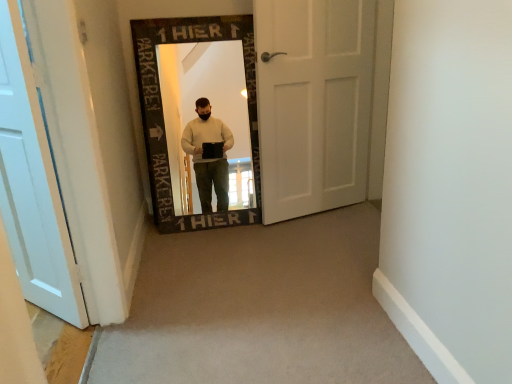
What do you see at coordinates (313, 103) in the screenshot? I see `white matte door at center, the 1th door in the back-to-front sequence` at bounding box center [313, 103].

The height and width of the screenshot is (384, 512). Find the location of `white matte door at center, positioned as the second door in left-to-right order`. white matte door at center, positioned as the second door in left-to-right order is located at coordinates (313, 103).

In order to face white matte door at center, positioned as the second door in left-to-right order, should I rotate leftwards or rightwards?

To face it directly, rotate right by 7.831 degrees.

Describe the element at coordinates (32, 185) in the screenshot. I see `white painted wood door at left, which is the second door from right to left` at that location.

This screenshot has width=512, height=384. Find the location of `white painted wood door at left, which is counted as the first door, starting from the front`. white painted wood door at left, which is counted as the first door, starting from the front is located at coordinates pyautogui.click(x=32, y=185).

I want to click on white matte door at center, the 1th door positioned from the right, so click(x=313, y=103).

Is white painted wood door at left, which is the second door from right to left, to the left or to the right of white matte door at center, the 1th door in the back-to-front sequence, in the image?

white painted wood door at left, which is the second door from right to left, is to the left of white matte door at center, the 1th door in the back-to-front sequence.

Considering the relative positions of white painted wood door at left, which is the second door from right to left, and white matte door at center, the 1th door positioned from the right, in the image provided, is white painted wood door at left, which is the second door from right to left, behind white matte door at center, the 1th door positioned from the right,?

That is False.

Considering the positions of points (70, 308) and (317, 65), is point (70, 308) farther from camera compared to point (317, 65)?

That is False.

From the image's perspective, which is below, white painted wood door at left, which is counted as the first door, starting from the front, or white matte door at center, the 1th door positioned from the right?

From the image's view, white painted wood door at left, which is counted as the first door, starting from the front, is below.

From a real-world perspective, between white painted wood door at left, which is the second door from right to left, and white matte door at center, the 1th door positioned from the right, who is vertically higher?

white matte door at center, the 1th door positioned from the right, is physically above.

Can you confirm if white painted wood door at left, which is the second door from right to left, is thinner than white matte door at center, the 1th door in the back-to-front sequence?

In fact, white painted wood door at left, which is the second door from right to left, might be wider than white matte door at center, the 1th door in the back-to-front sequence.

Looking at this image, is white painted wood door at left, which is the second door from right to left, taller than white matte door at center, the 1th door in the back-to-front sequence?

In fact, white painted wood door at left, which is the second door from right to left, may be shorter than white matte door at center, the 1th door in the back-to-front sequence.

Who is smaller, white painted wood door at left, which is the second door from right to left, or white matte door at center, the 1th door in the back-to-front sequence?

With smaller size is white matte door at center, the 1th door in the back-to-front sequence.

Choose the correct answer: Is white painted wood door at left, placed as the second door when sorted from back to front, inside white matte door at center, positioned as the second door in left-to-right order, or outside it?

white painted wood door at left, placed as the second door when sorted from back to front, is not enclosed by white matte door at center, positioned as the second door in left-to-right order.

Is white painted wood door at left, placed as the second door when sorted from back to front, in contact with white matte door at center, the 1th door positioned from the right?

No, white painted wood door at left, placed as the second door when sorted from back to front, is not making contact with white matte door at center, the 1th door positioned from the right.

Is white painted wood door at left, which is the second door from right to left, positioned with its back to white matte door at center, positioned as the second door in left-to-right order?

Absolutely, white painted wood door at left, which is the second door from right to left, is directed away from white matte door at center, positioned as the second door in left-to-right order.

Locate an element on the screen. door on the right of the white painted wood door at left, which is the first door from left to right is located at coordinates (313, 103).

Based on their positions, is white matte door at center, the 1th door in the back-to-front sequence, located to the left or right of white painted wood door at left, placed as the second door when sorted from back to front?

white matte door at center, the 1th door in the back-to-front sequence, is positioned on white painted wood door at left, placed as the second door when sorted from back to front,'s right side.

In the image, is white matte door at center, the 1th door positioned from the right, positioned in front of or behind white painted wood door at left, which is the second door from right to left?

In the image, white matte door at center, the 1th door positioned from the right, appears behind white painted wood door at left, which is the second door from right to left.

Which point is more distant from viewer, [297,172] or [36,176]?

Positioned behind is point [297,172].

From the image's perspective, relative to white painted wood door at left, which is counted as the first door, starting from the front, is white matte door at center, which is the 2th door from front to back, above or below?

Clearly, from the image's perspective, white matte door at center, which is the 2th door from front to back, is above white painted wood door at left, which is counted as the first door, starting from the front.

From a real-world perspective, is white matte door at center, positioned as the second door in left-to-right order, positioned over white painted wood door at left, which is the second door from right to left, based on gravity?

Yes, from a real-world perspective, white matte door at center, positioned as the second door in left-to-right order, is above white painted wood door at left, which is the second door from right to left.

Which of these two, white matte door at center, the 1th door in the back-to-front sequence, or white painted wood door at left, which is the second door from right to left, is wider?

With larger width is white painted wood door at left, which is the second door from right to left.

Considering the relative sizes of white matte door at center, which is the 2th door from front to back, and white painted wood door at left, which is the second door from right to left, in the image provided, is white matte door at center, which is the 2th door from front to back, shorter than white painted wood door at left, which is the second door from right to left,?

In fact, white matte door at center, which is the 2th door from front to back, may be taller than white painted wood door at left, which is the second door from right to left.

From the picture: Considering the sizes of white matte door at center, the 1th door in the back-to-front sequence, and white painted wood door at left, which is the first door from left to right, in the image, is white matte door at center, the 1th door in the back-to-front sequence, bigger or smaller than white painted wood door at left, which is the first door from left to right,?

Considering their sizes, white matte door at center, the 1th door in the back-to-front sequence, takes up less space than white painted wood door at left, which is the first door from left to right.

Is white painted wood door at left, placed as the second door when sorted from back to front, completely or partially inside white matte door at center, the 1th door in the back-to-front sequence?

No, white painted wood door at left, placed as the second door when sorted from back to front, is not inside white matte door at center, the 1th door in the back-to-front sequence.

Are white matte door at center, the 1th door positioned from the right, and white painted wood door at left, which is the first door from left to right, beside each other?

There is a gap between white matte door at center, the 1th door positioned from the right, and white painted wood door at left, which is the first door from left to right.

Is white matte door at center, which is the 2th door from front to back, oriented towards white painted wood door at left, which is the second door from right to left?

No, white matte door at center, which is the 2th door from front to back, is not aimed at white painted wood door at left, which is the second door from right to left.

Can you tell me how much white matte door at center, positioned as the second door in left-to-right order, and white painted wood door at left, which is the first door from left to right, differ in facing direction?

The angle between the facing direction of white matte door at center, positioned as the second door in left-to-right order, and the facing direction of white painted wood door at left, which is the first door from left to right, is 63 degrees.

Locate an element on the screen. The image size is (512, 384). door positioned vertically above the white painted wood door at left, which is counted as the first door, starting from the front (from a real-world perspective) is located at coordinates click(313, 103).

Identify the location of door located underneath the white matte door at center, the 1th door in the back-to-front sequence (from a real-world perspective). (32, 185).

Image resolution: width=512 pixels, height=384 pixels. Identify the location of door that appears in front of the white matte door at center, the 1th door positioned from the right. click(x=32, y=185).